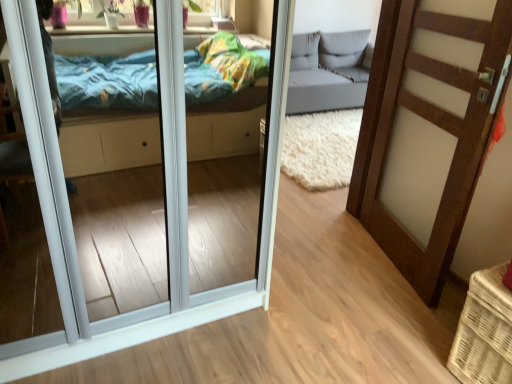
Where is `free space between white glossy door at center, positioned as the 1th door in left-to-right order, and brown wood door at right, which is the 2th door from left to right`? This screenshot has height=384, width=512. free space between white glossy door at center, positioned as the 1th door in left-to-right order, and brown wood door at right, which is the 2th door from left to right is located at coordinates (314, 285).